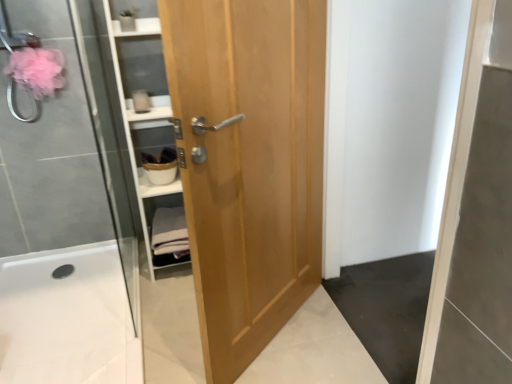
Question: In terms of height, does white glossy bath at lower left look taller or shorter compared to light brown wood door at center?

Choices:
 (A) short
 (B) tall

Answer: (A)

Question: Looking at the image, does white glossy bath at lower left seem bigger or smaller compared to light brown wood door at center?

Choices:
 (A) small
 (B) big

Answer: (A)

Question: Which object is positioned closest to the light brown wood door at center?

Choices:
 (A) white glossy bath at lower left
 (B) white cotton towels at center

Answer: (B)

Question: Which is nearer to the light brown wood door at center?

Choices:
 (A) white cotton towels at center
 (B) white glossy bath at lower left

Answer: (A)